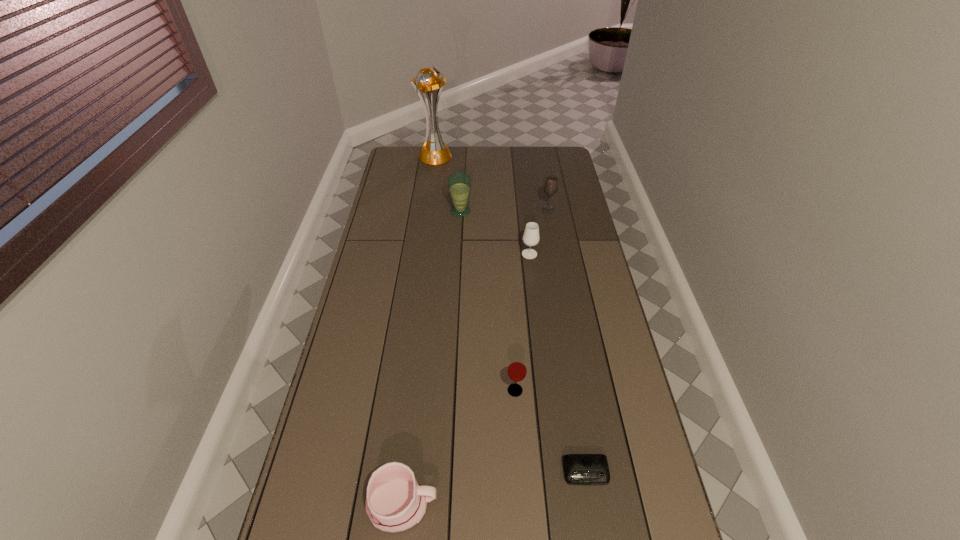
Where is `free space that satisfies the following two spatial constraints: 1. on the front-facing side of the trophy; 2. on the right side of the rightmost glass`? The image size is (960, 540). free space that satisfies the following two spatial constraints: 1. on the front-facing side of the trophy; 2. on the right side of the rightmost glass is located at coordinates (427, 210).

Image resolution: width=960 pixels, height=540 pixels. I want to click on vacant region that satisfies the following two spatial constraints: 1. on the front side of the third glass from left to right; 2. on the left side of the leftmost glass, so click(458, 254).

Find the location of `free space that satisfies the following two spatial constraints: 1. on the front side of the rightmost glass; 2. on the side with the handle of the sixth tallest object`. free space that satisfies the following two spatial constraints: 1. on the front side of the rightmost glass; 2. on the side with the handle of the sixth tallest object is located at coordinates (602, 505).

This screenshot has width=960, height=540. What are the coordinates of `vacant space that satisfies the following two spatial constraints: 1. on the front-facing side of the trophy; 2. on the right side of the second glass from left to right` in the screenshot? It's located at (402, 390).